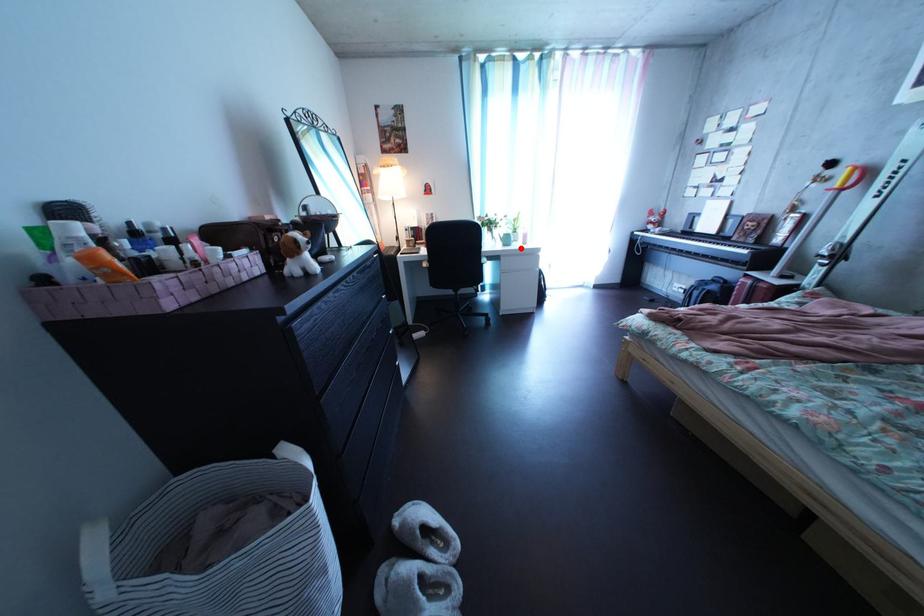
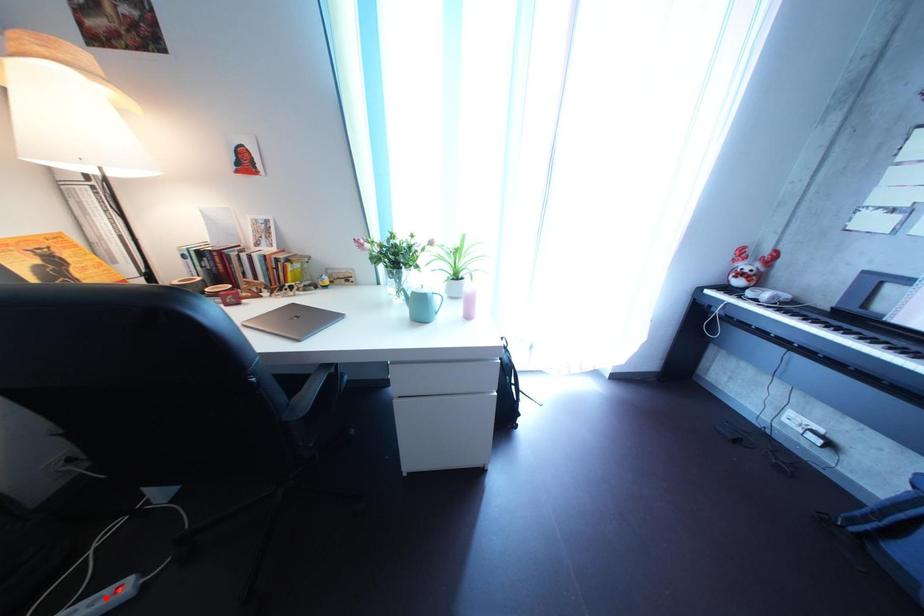
I am providing you with two images of the same scene from different viewpoints. A red point is marked on the first image and another point is marked on the second image. Do the highlighted points in image1 and image2 indicate the same real-world spot?

No